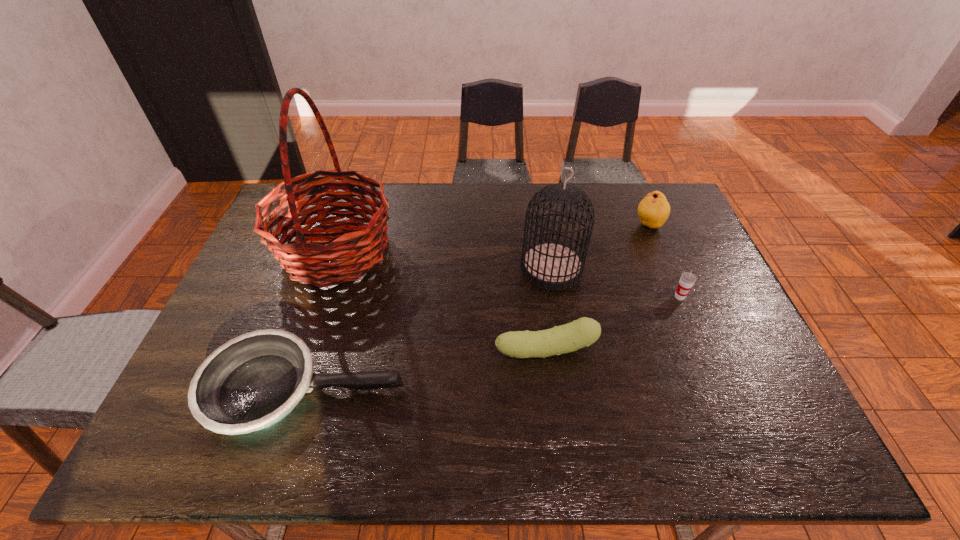
Where is `the tallest object`? This screenshot has width=960, height=540. the tallest object is located at coordinates (306, 262).

The image size is (960, 540). In order to click on the second tallest object in this screenshot , I will do `click(552, 265)`.

Locate an element on the screen. pear is located at coordinates (654, 209).

This screenshot has height=540, width=960. Find the location of `cup`. cup is located at coordinates (687, 279).

I want to click on cucumber, so click(584, 331).

In order to click on the shortest object in this screenshot , I will do `click(253, 381)`.

At what (x,y) coordinates should I click in order to perform the action: click on free space located on the left of the basket. Please return your answer as a coordinate pair (x, y). Image resolution: width=960 pixels, height=540 pixels. Looking at the image, I should click on (255, 251).

Identify the location of free space located on the right of the birdcage. This screenshot has width=960, height=540. (665, 268).

Identify the location of free space located 0.390m on the left of the pear. (518, 225).

Image resolution: width=960 pixels, height=540 pixels. I want to click on vacant space located 0.390m on the side of the cup with the logo, so click(x=738, y=436).